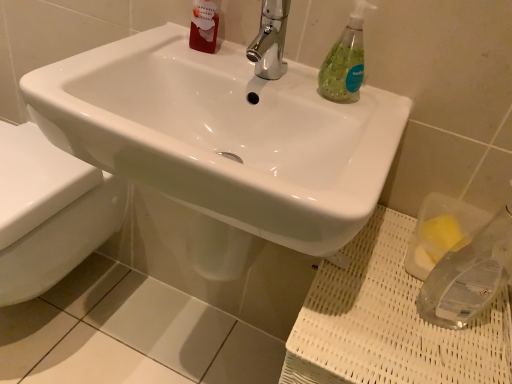
The height and width of the screenshot is (384, 512). I want to click on vacant space positioned to the left of chrome metallic faucet at upper center, so click(192, 64).